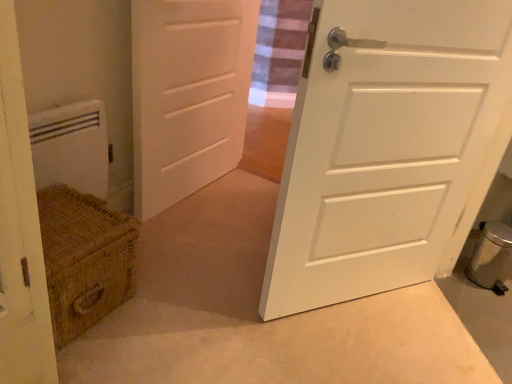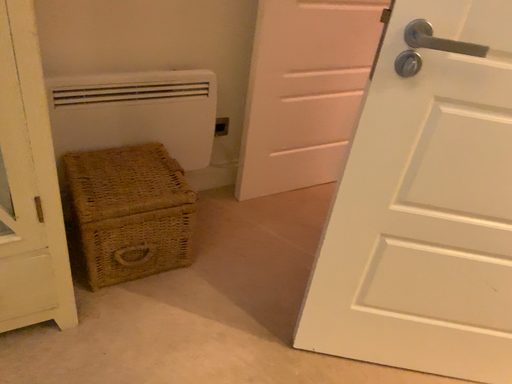
Question: Which way did the camera rotate in the video?

Choices:
 (A) rotated right
 (B) rotated left

Answer: (B)